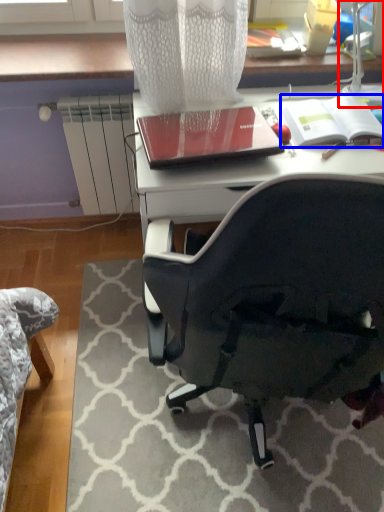
Question: Which point is closer to the camera, table lamp (highlighted by a red box) or notebook (highlighted by a blue box)?

Choices:
 (A) table lamp
 (B) notebook

Answer: (A)